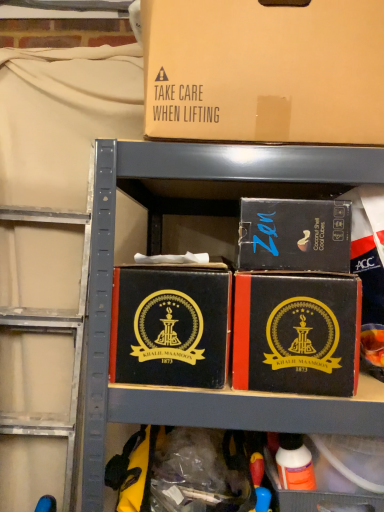
Question: From the image's perspective, is black cardboard box at center, which appears as the first box when ordered from the bottom, positioned above or below orange matte bottle at lower right?

Choices:
 (A) above
 (B) below

Answer: (A)

Question: Looking at the image, does black cardboard box at center, the fourth box in the top-to-bottom sequence, seem bigger or smaller compared to orange matte bottle at lower right?

Choices:
 (A) big
 (B) small

Answer: (A)

Question: Which of these objects is positioned farthest from the black leather box at center, which ranks as the 2th box in bottom-to-top order?

Choices:
 (A) black cardboard box at center, placed as the 3th box when sorted from bottom to top
 (B) orange matte bottle at lower right
 (C) black cardboard box at center, which appears as the first box when ordered from the bottom
 (D) brown cardboard box at upper center, marked as the first box in a top-to-bottom arrangement

Answer: (B)

Question: Estimate the real-world distances between objects in this image. Which object is farther from the black cardboard box at center, the fourth box in the top-to-bottom sequence?

Choices:
 (A) black leather box at center, the third box viewed from the top
 (B) brown cardboard box at upper center, marked as the first box in a top-to-bottom arrangement
 (C) orange matte bottle at lower right
 (D) black cardboard box at center, acting as the 2th box starting from the top

Answer: (C)